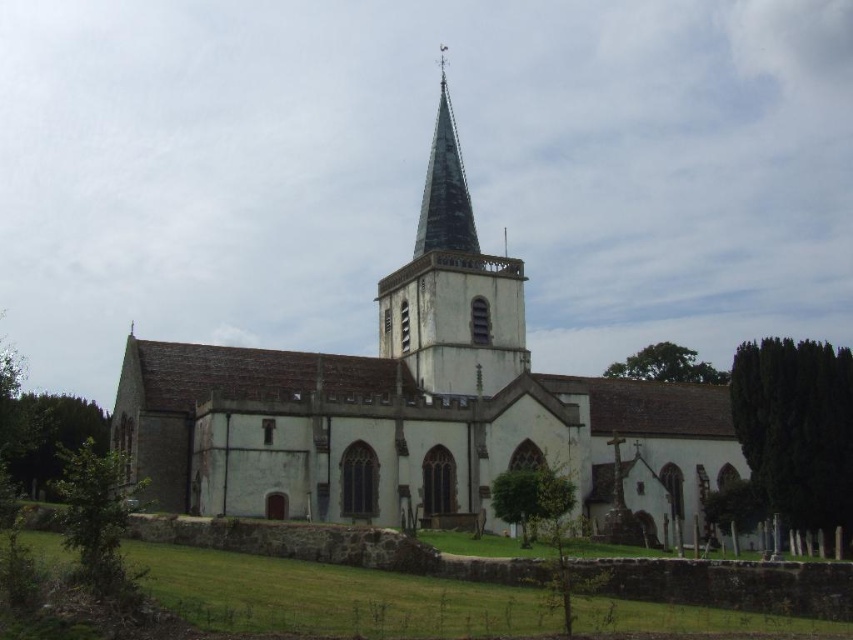
Question: Which of the following is the farthest from the observer?

Choices:
 (A) (432, 161)
 (B) (482, 378)
 (C) (502, 440)

Answer: (A)

Question: Which object appears closest to the camera in this image?

Choices:
 (A) green copper steeple at center
 (B) white stone church at center
 (C) green glass spire at upper center

Answer: (B)

Question: Which point is farther to the camera?

Choices:
 (A) green glass spire at upper center
 (B) white stone church at center
 (C) green copper steeple at center

Answer: (A)

Question: Can you confirm if green copper steeple at center is wider than green glass spire at upper center?

Choices:
 (A) no
 (B) yes

Answer: (B)

Question: Where is white stone church at center located in relation to green copper steeple at center in the image?

Choices:
 (A) above
 (B) below

Answer: (B)

Question: Is white stone church at center smaller than green glass spire at upper center?

Choices:
 (A) yes
 (B) no

Answer: (B)